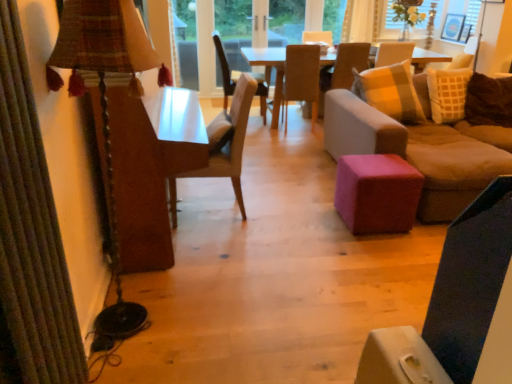
At what (x,y) coordinates should I click in order to perform the action: click on free location to the left of pink fabric ottoman at center. Please return your answer as a coordinate pair (x, y). Looking at the image, I should click on (316, 218).